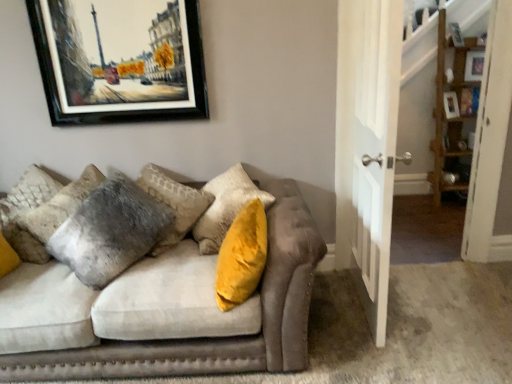
Question: Is wooden shelf at right not near black matte picture frame at upper left?

Choices:
 (A) yes
 (B) no

Answer: (A)

Question: Considering the relative sizes of wooden shelf at right and black matte picture frame at upper left in the image provided, is wooden shelf at right smaller than black matte picture frame at upper left?

Choices:
 (A) yes
 (B) no

Answer: (B)

Question: Is wooden shelf at right positioned with its back to black matte picture frame at upper left?

Choices:
 (A) yes
 (B) no

Answer: (B)

Question: Is wooden shelf at right at the right side of black matte picture frame at upper left?

Choices:
 (A) yes
 (B) no

Answer: (A)

Question: Is wooden shelf at right taller than black matte picture frame at upper left?

Choices:
 (A) yes
 (B) no

Answer: (A)

Question: Is point (72, 344) closer or farther from the camera than point (192, 3)?

Choices:
 (A) farther
 (B) closer

Answer: (B)

Question: Is velvet gray couch at center in front of or behind black matte picture frame at upper left in the image?

Choices:
 (A) front
 (B) behind

Answer: (A)

Question: From the image's perspective, is velvet gray couch at center above or below black matte picture frame at upper left?

Choices:
 (A) below
 (B) above

Answer: (A)

Question: Considering the positions of velvet gray couch at center and black matte picture frame at upper left in the image, is velvet gray couch at center taller or shorter than black matte picture frame at upper left?

Choices:
 (A) tall
 (B) short

Answer: (B)

Question: From the image's perspective, relative to velvet gray couch at center, is velvet gray pillow at left above or below?

Choices:
 (A) above
 (B) below

Answer: (A)

Question: In terms of height, does velvet gray pillow at left look taller or shorter compared to velvet gray couch at center?

Choices:
 (A) short
 (B) tall

Answer: (B)

Question: In the image, is velvet gray pillow at left positioned in front of or behind velvet gray couch at center?

Choices:
 (A) front
 (B) behind

Answer: (B)

Question: Is velvet gray pillow at left to the left or to the right of velvet gray couch at center in the image?

Choices:
 (A) left
 (B) right

Answer: (A)

Question: From the image's perspective, relative to velvet gray couch at center, is wooden shelf at right above or below?

Choices:
 (A) above
 (B) below

Answer: (A)

Question: Is point (458, 125) positioned closer to the camera than point (190, 289)?

Choices:
 (A) closer
 (B) farther

Answer: (B)